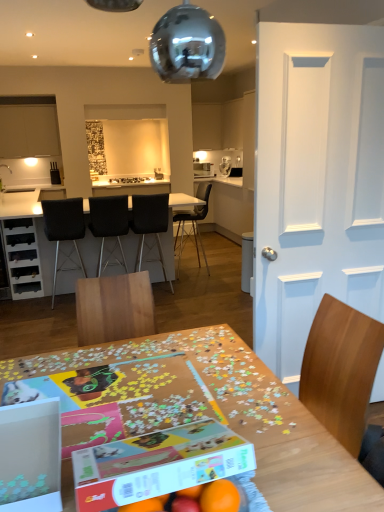
How much space does white glossy table at center, positioned as the first table in top-to-bottom order, occupy vertically?

It is 94.15 centimeters.

What is the approximate width of orange matte at lower center?

orange matte at lower center is 6.76 centimeters wide.

What do you see at coordinates (219, 497) in the screenshot? I see `orange matte at lower center` at bounding box center [219, 497].

Image resolution: width=384 pixels, height=512 pixels. Describe the element at coordinates (149, 223) in the screenshot. I see `black leather chair at center, the 3th chair viewed from the left` at that location.

I want to click on white cardboard box at center, placed as the 2th cardboard box when sorted from left to right, so click(158, 464).

From a real-world perspective, is white glossy table at center, which ranks as the second table in bottom-to-top order, below wooden puzzle table at center, arranged as the 2th table when viewed from the back?

Incorrect, from a real-world perspective, white glossy table at center, which ranks as the second table in bottom-to-top order, is higher than wooden puzzle table at center, arranged as the 2th table when viewed from the back.

From the image's perspective, who appears lower, white glossy table at center, placed as the first table when sorted from back to front, or wooden puzzle table at center, marked as the second table in a top-to-bottom arrangement?

wooden puzzle table at center, marked as the second table in a top-to-bottom arrangement, appears lower in the image.

Is the surface of white glossy table at center, placed as the first table when sorted from back to front, in direct contact with wooden puzzle table at center, arranged as the 2th table when viewed from the back?

No, white glossy table at center, placed as the first table when sorted from back to front, is not beside wooden puzzle table at center, arranged as the 2th table when viewed from the back.

Which of these two, white glossy table at center, which ranks as the second table in bottom-to-top order, or wooden puzzle table at center, marked as the second table in a top-to-bottom arrangement, is bigger?

With larger size is white glossy table at center, which ranks as the second table in bottom-to-top order.

Based on their sizes in the image, would you say orange matte at lower center is bigger or smaller than black leather chair at center, arranged as the second chair when viewed from the left?

In the image, orange matte at lower center appears to be smaller than black leather chair at center, arranged as the second chair when viewed from the left.

From the orange matte at lower center, count 2nd chairs backward and point to it. Please provide its 2D coordinates.

[(109, 223)]

From the image's perspective, between orange matte at lower center and black leather chair at center, arranged as the second chair when viewed from the left, which one is located above?

black leather chair at center, arranged as the second chair when viewed from the left.

Is the depth of orange matte at lower center greater than that of black leather chair at center, the third chair in the right-to-left sequence?

No, orange matte at lower center is closer to the viewer.

From a real-world perspective, is black matte chair at center, the fourth chair positioned from the left, located higher than white cardboard box at center, which is the 1th cardboard box in right-to-left order?

No, from a real-world perspective, black matte chair at center, the fourth chair positioned from the left, is not over white cardboard box at center, which is the 1th cardboard box in right-to-left order

Which is behind, point (177, 219) or point (115, 461)?

The point (177, 219) is farther.

Which cardboard box is the 1st one when counting from the left side of the black matte chair at center, the fourth chair positioned from the left? Please provide its 2D coordinates.

[(158, 464)]

Which of these two, black matte chair at center, the fourth chair positioned from the left, or white cardboard box at center, which is the 1th cardboard box in right-to-left order, stands taller?

With more height is black matte chair at center, the fourth chair positioned from the left.

What's the angular difference between wooden puzzle table at center, marked as the second table in a top-to-bottom arrangement, and white cardboard box at lower left, the 1th cardboard box in the left-to-right sequence,'s facing directions?

The angle between the facing direction of wooden puzzle table at center, marked as the second table in a top-to-bottom arrangement, and the facing direction of white cardboard box at lower left, the 1th cardboard box in the left-to-right sequence, is 0.755 degrees.

Is wooden puzzle table at center, marked as the first table in a front-to-back arrangement, to the right of white cardboard box at lower left, the 1th cardboard box in the left-to-right sequence, from the viewer's perspective?

Yes.

Which object is thinner, wooden puzzle table at center, marked as the second table in a top-to-bottom arrangement, or white cardboard box at lower left, the 1th cardboard box in the left-to-right sequence?

white cardboard box at lower left, the 1th cardboard box in the left-to-right sequence, is thinner.

Does wooden puzzle table at center, marked as the second table in a top-to-bottom arrangement, lie in front of white cardboard box at lower left, the second cardboard box from the right?

Yes, wooden puzzle table at center, marked as the second table in a top-to-bottom arrangement, is closer to the camera.

Does white cardboard box at center, which is the 1th cardboard box in right-to-left order, lie behind white glossy table at center, placed as the first table when sorted from back to front?

No, white cardboard box at center, which is the 1th cardboard box in right-to-left order, is closer to the camera.

Can you confirm if white cardboard box at center, which is the 1th cardboard box in right-to-left order, is positioned to the left of white glossy table at center, positioned as the first table in top-to-bottom order?

No.

Between point (131, 461) and point (9, 219), which one is positioned behind?

Point (9, 219)

Is white cardboard box at center, placed as the 2th cardboard box when sorted from left to right, next to white glossy table at center, the 2th table from the front, and touching it?

No, white cardboard box at center, placed as the 2th cardboard box when sorted from left to right, is not in contact with white glossy table at center, the 2th table from the front.

From the picture: Which is closer to the camera, (x=57, y=508) or (x=42, y=239)?

Point (x=57, y=508) is positioned closer to the camera compared to point (x=42, y=239).

Based on the photo, would you say white cardboard box at lower left, the second cardboard box from the right, is inside or outside white glossy table at center, positioned as the first table in top-to-bottom order?

The correct answer is: outside.

From the image's perspective, is white cardboard box at center, placed as the 2th cardboard box when sorted from left to right, above or below orange matte at lower center?

From the image's perspective, white cardboard box at center, placed as the 2th cardboard box when sorted from left to right, appears above orange matte at lower center.

Considering the sizes of objects white cardboard box at center, which is the 1th cardboard box in right-to-left order, and orange matte at lower center in the image provided, who is smaller, white cardboard box at center, which is the 1th cardboard box in right-to-left order, or orange matte at lower center?

With smaller size is orange matte at lower center.

In terms of width, does white cardboard box at center, placed as the 2th cardboard box when sorted from left to right, look wider or thinner when compared to orange matte at lower center?

Considering their sizes, white cardboard box at center, placed as the 2th cardboard box when sorted from left to right, looks broader than orange matte at lower center.

Relative to orange matte at lower center, is white cardboard box at center, placed as the 2th cardboard box when sorted from left to right, in front or behind?

Clearly, white cardboard box at center, placed as the 2th cardboard box when sorted from left to right, is in front of orange matte at lower center.

Find the location of `table below the white glossy table at center, the 2th table from the front (from a real-world perspective)`. table below the white glossy table at center, the 2th table from the front (from a real-world perspective) is located at coordinates (244, 416).

You are a GUI agent. You are given a task and a screenshot of the screen. Output one action in this format:
    pyautogui.click(x=<x>, y=<y>)
    Task: Click on the chair that is the 2nd one when counting backward from the orange matte at lower center
    This screenshot has width=384, height=512.
    Given the screenshot: What is the action you would take?
    pyautogui.click(x=109, y=223)

Looking at the image, which one is located further to wooden puzzle table at center, arranged as the 2th table when viewed from the back, black mesh chair at center, which appears as the 4th chair when viewed from the right, or white glossy table at center, placed as the first table when sorted from back to front?

white glossy table at center, placed as the first table when sorted from back to front, is positioned further to the anchor wooden puzzle table at center, arranged as the 2th table when viewed from the back.

Which object lies nearer to the anchor point orange matte at lower center, wooden puzzle table at center, marked as the second table in a top-to-bottom arrangement, or white cardboard box at center, which is the 1th cardboard box in right-to-left order?

white cardboard box at center, which is the 1th cardboard box in right-to-left order, is positioned closer to the anchor orange matte at lower center.

Based on their spatial positions, is black leather chair at center, the third chair in the right-to-left sequence, or white cardboard box at center, which is the 1th cardboard box in right-to-left order, further from wooden puzzle table at center, the first table ordered from the bottom?

black leather chair at center, the third chair in the right-to-left sequence.

When comparing their distances from white painted wood door at right, does matte white cabinet at upper left or black mesh chair at center, which appears as the 4th chair when viewed from the right, seem closer?

black mesh chair at center, which appears as the 4th chair when viewed from the right, is closer to white painted wood door at right.

Estimate the real-world distances between objects in this image. Which object is closer to white cardboard box at center, placed as the 2th cardboard box when sorted from left to right, black matte chair at center, which is the 1th chair in right-to-left order, or matte white cabinet at upper left?

black matte chair at center, which is the 1th chair in right-to-left order, lies closer to white cardboard box at center, placed as the 2th cardboard box when sorted from left to right, than the other object.

From the image, which object appears to be farther from orange matte at lower center, wooden puzzle table at center, marked as the first table in a front-to-back arrangement, or matte white cabinet at upper left?

matte white cabinet at upper left is positioned further to the anchor orange matte at lower center.

Which object lies further to the anchor point orange matte at lower center, wooden puzzle table at center, arranged as the 2th table when viewed from the back, or white glossy table at center, placed as the first table when sorted from back to front?

white glossy table at center, placed as the first table when sorted from back to front, lies further to orange matte at lower center than the other object.

Based on their spatial positions, is matte white cabinet at upper left or white painted wood door at right closer to black leather chair at center, arranged as the second chair when viewed from the left?

white painted wood door at right is closer to black leather chair at center, arranged as the second chair when viewed from the left.

Locate an element on the screen. The image size is (384, 512). door located between orange matte at lower center and black mesh chair at center, which appears as the 4th chair when viewed from the right, in the depth direction is located at coordinates (316, 181).

This screenshot has width=384, height=512. Identify the location of door between wooden puzzle table at center, marked as the first table in a front-to-back arrangement, and white glossy table at center, positioned as the first table in top-to-bottom order, in the front-back direction. (316, 181).

Locate an element on the screen. table between wooden puzzle table at center, arranged as the 2th table when viewed from the back, and black leather chair at center, the 3th chair viewed from the left, along the z-axis is located at coordinates (37, 249).

This screenshot has width=384, height=512. What are the coordinates of `table between white cardboard box at lower left, the second cardboard box from the right, and orange matte at lower center, in the horizontal direction` in the screenshot? It's located at (244, 416).